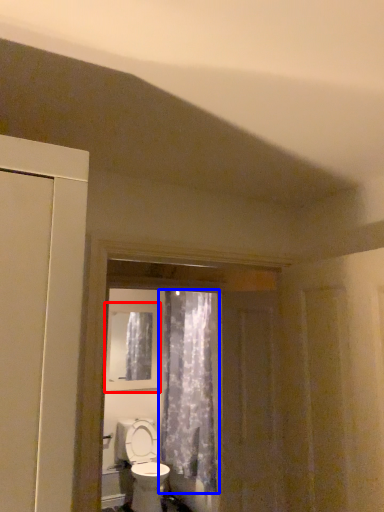
Question: Which of the following is the farthest to the observer, window (highlighted by a red box) or curtain (highlighted by a blue box)?

Choices:
 (A) window
 (B) curtain

Answer: (A)